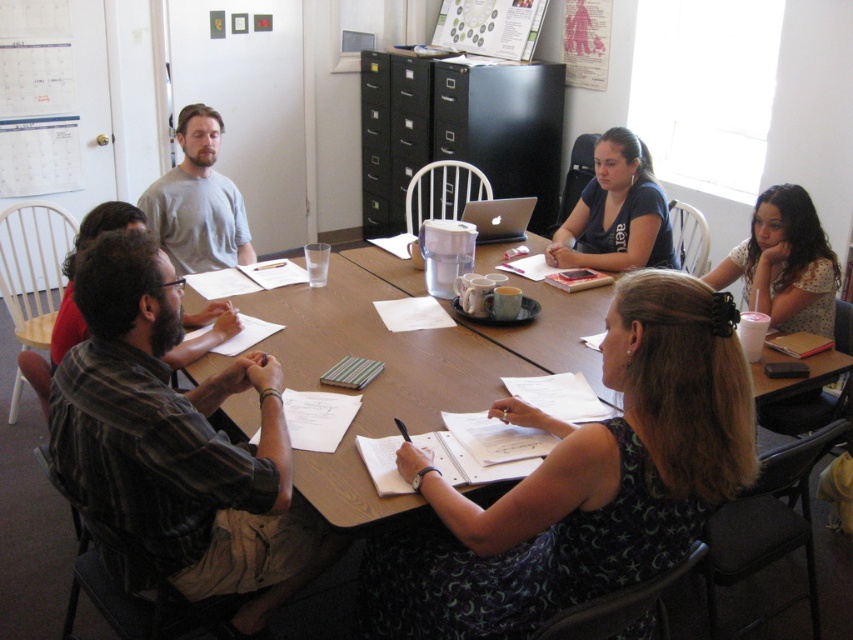
You are standing at the entrance of the meeting room and want to walk directly to the wooden table at center. According to the coordinates provided, in which direction should you move relative to your current position?

The wooden table at center is located at coordinates point (x=405, y=364), so you should move towards the direction indicated by those coordinates to reach it directly.

You are standing in the room and want to reach the point marked at coordinates (x=624, y=308) on the table. Considering the people seated around it, can you estimate if there is enough space to walk directly to that point without stepping over any chairs?

The distance between the viewer and the point marked at coordinates (x=624, y=308) is 1.45 meters. However, the path to the point may be obstructed by the six seated individuals around the table, making it difficult to walk directly there without stepping over chairs.